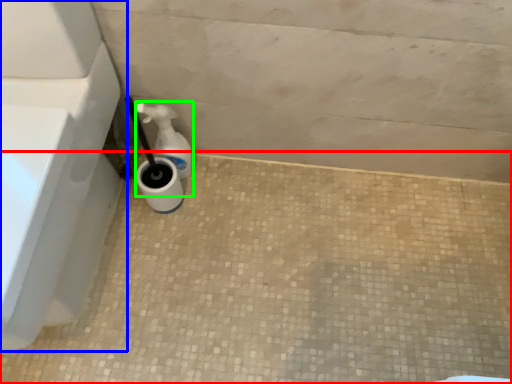
Question: Estimate the real-world distances between objects in this image. Which object is farther from concrete (highlighted by a red box), bath (highlighted by a blue box) or soap dispenser (highlighted by a green box)?

Choices:
 (A) bath
 (B) soap dispenser

Answer: (B)